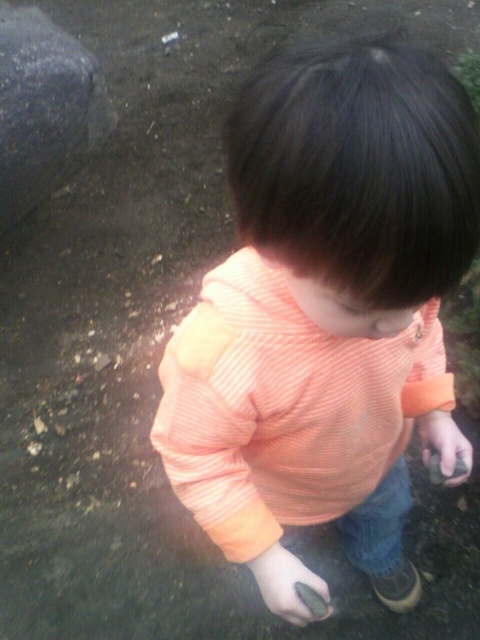
You are a photographer trying to capture the child in the scene. You want to ensure the orange striped shirt at center and the smooth gray rock at lower center are both clearly visible. Which object should you focus on first if you want the other to remain in focus?

The orange striped shirt at center is positioned on the right side of smooth gray rock at lower center. To keep both in focus, focus on the smooth gray rock at lower center since it is closer to the camera.

Consider the image. You are a photographer trying to capture the child in the image. Since the orange striped shirt at center and the smooth gray rock at lower center are both in focus, which one will appear more detailed in the photo?

The orange striped shirt at center will appear more detailed in the photo because it is bigger than the smooth gray rock at lower center.

You are a photographer trying to capture a photo of the orange striped shirt at center and the smooth gray rock at lower right. Which object should you focus on first if you want to ensure both are in the frame and the shirt appears larger than the rock? Explain your reasoning based on their positions.

You should focus on the orange striped shirt at center first because it is taller than the smooth gray rock at lower right, so positioning the camera to include its full height will naturally make the shirt appear larger in the photo while still capturing the rock in the frame.